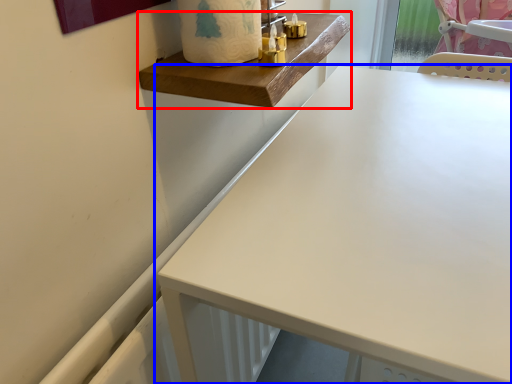
Question: Which object is closer to the camera taking this photo, changing table (highlighted by a red box) or table (highlighted by a blue box)?

Choices:
 (A) changing table
 (B) table

Answer: (B)